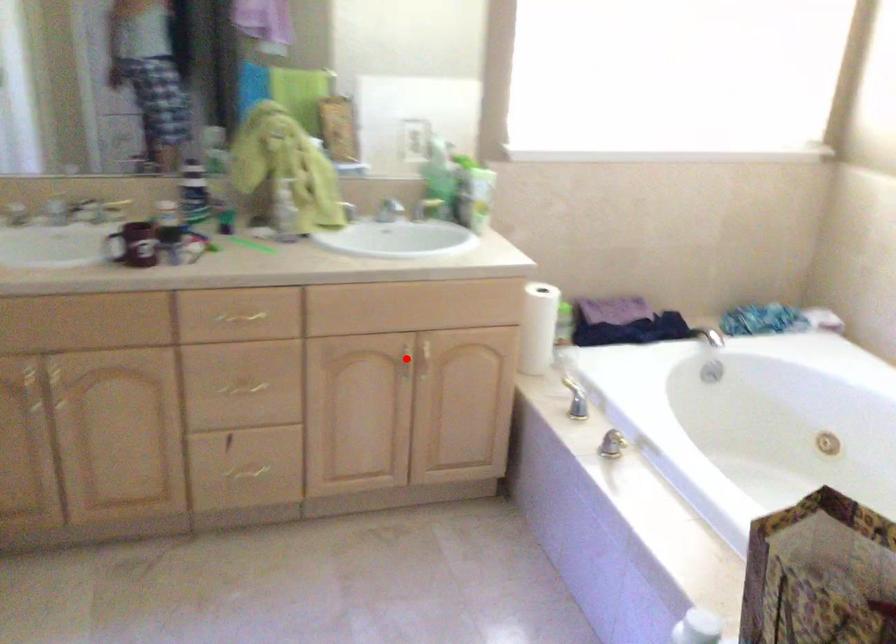
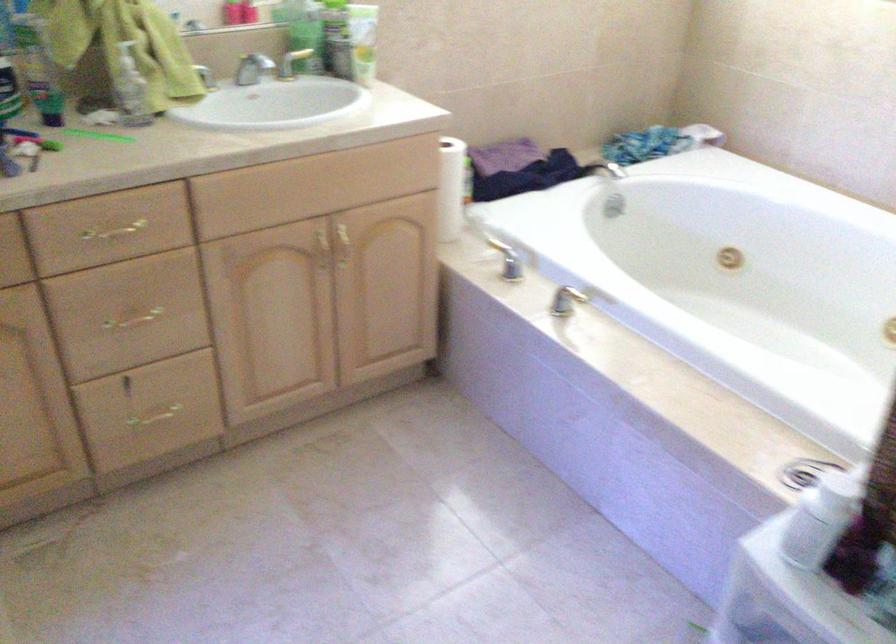
Find the pixel in the second image that matches the highlighted location in the first image.

(321, 249)